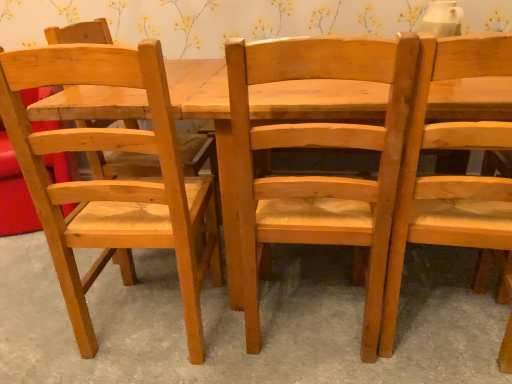
The height and width of the screenshot is (384, 512). What do you see at coordinates (113, 181) in the screenshot?
I see `natural wood chair at left, placed as the first chair when sorted from left to right` at bounding box center [113, 181].

What do you see at coordinates (452, 176) in the screenshot?
I see `natural wood chair at right, the 3th chair viewed from the left` at bounding box center [452, 176].

Where is `natural wood chair at right, the 1th chair from the right`? This screenshot has height=384, width=512. natural wood chair at right, the 1th chair from the right is located at coordinates tap(452, 176).

What do you see at coordinates (318, 146) in the screenshot? The width and height of the screenshot is (512, 384). I see `natural wood chair at center, which is the second chair from left to right` at bounding box center [318, 146].

This screenshot has height=384, width=512. What are the coordinates of `natural wood chair at left, the 3th chair viewed from the right` in the screenshot? It's located at (113, 181).

Considering the relative positions of natural wood chair at right, the 1th chair from the right, and natural wood chair at left, placed as the first chair when sorted from left to right, in the image provided, is natural wood chair at right, the 1th chair from the right, to the left or to the right of natural wood chair at left, placed as the first chair when sorted from left to right,?

Based on their positions, natural wood chair at right, the 1th chair from the right, is located to the right of natural wood chair at left, placed as the first chair when sorted from left to right.

From a real-world perspective, who is located higher, natural wood chair at right, the 3th chair viewed from the left, or natural wood chair at left, placed as the first chair when sorted from left to right?

natural wood chair at left, placed as the first chair when sorted from left to right.

Is natural wood chair at right, the 3th chair viewed from the left, aimed at natural wood chair at left, the 3th chair viewed from the right?

No, natural wood chair at right, the 3th chair viewed from the left, does not turn towards natural wood chair at left, the 3th chair viewed from the right.

Is point (411, 262) less distant than point (400, 154)?

No.

Can we say natural wood chair at center lies outside natural wood chair at center, marked as the second chair in a right-to-left arrangement?

Yes, natural wood chair at center is outside of natural wood chair at center, marked as the second chair in a right-to-left arrangement.

Relative to natural wood chair at center, marked as the second chair in a right-to-left arrangement, is natural wood chair at center in front or behind?

Clearly, natural wood chair at center is behind natural wood chair at center, marked as the second chair in a right-to-left arrangement.

Is natural wood chair at right, the 1th chair from the right, taller or shorter than natural wood chair at center, which is the second chair from left to right?

natural wood chair at right, the 1th chair from the right, is taller than natural wood chair at center, which is the second chair from left to right.

Where is `chair that is the 1st one when counting leftward from the natural wood chair at right, the 3th chair viewed from the left`? This screenshot has width=512, height=384. chair that is the 1st one when counting leftward from the natural wood chair at right, the 3th chair viewed from the left is located at coordinates (318, 146).

Which object is further away from the camera, natural wood chair at right, the 1th chair from the right, or natural wood chair at center, marked as the second chair in a right-to-left arrangement?

natural wood chair at center, marked as the second chair in a right-to-left arrangement, is more distant.

Which object is positioned more to the left, natural wood chair at right, the 1th chair from the right, or natural wood chair at center, marked as the second chair in a right-to-left arrangement?

Positioned to the left is natural wood chair at center, marked as the second chair in a right-to-left arrangement.

Is natural wood chair at center, marked as the second chair in a right-to-left arrangement, positioned far away from natural wood chair at center?

No, natural wood chair at center, marked as the second chair in a right-to-left arrangement, is not far from natural wood chair at center.

Is natural wood chair at center, marked as the second chair in a right-to-left arrangement, oriented towards natural wood chair at center?

No, natural wood chair at center, marked as the second chair in a right-to-left arrangement, is not turned towards natural wood chair at center.

Is natural wood chair at center, marked as the second chair in a right-to-left arrangement, inside or outside of natural wood chair at center?

natural wood chair at center, marked as the second chair in a right-to-left arrangement, lies outside natural wood chair at center.

Is point (236, 149) positioned behind point (490, 349)?

No.

Is natural wood chair at right, the 3th chair viewed from the left, a part of natural wood chair at left, placed as the first chair when sorted from left to right?

That's incorrect, natural wood chair at right, the 3th chair viewed from the left, is not inside natural wood chair at left, placed as the first chair when sorted from left to right.

Which of these two, natural wood chair at left, placed as the first chair when sorted from left to right, or natural wood chair at right, the 3th chair viewed from the left, is bigger?

natural wood chair at left, placed as the first chair when sorted from left to right.

Looking at this image, which object is positioned more to the left, natural wood chair at left, placed as the first chair when sorted from left to right, or natural wood chair at right, the 1th chair from the right?

Positioned to the left is natural wood chair at left, placed as the first chair when sorted from left to right.

Who is smaller, natural wood chair at left, placed as the first chair when sorted from left to right, or natural wood chair at center, marked as the second chair in a right-to-left arrangement?

natural wood chair at center, marked as the second chair in a right-to-left arrangement, is smaller.

Is natural wood chair at left, placed as the first chair when sorted from left to right, directly adjacent to natural wood chair at center, marked as the second chair in a right-to-left arrangement?

There is a gap between natural wood chair at left, placed as the first chair when sorted from left to right, and natural wood chair at center, marked as the second chair in a right-to-left arrangement.

Based on the photo, from a real-world perspective, is natural wood chair at left, the 3th chair viewed from the right, on natural wood chair at center, marked as the second chair in a right-to-left arrangement?

Yes, from a real-world perspective, natural wood chair at left, the 3th chair viewed from the right, is over natural wood chair at center, marked as the second chair in a right-to-left arrangement

Is natural wood chair at center taller than natural wood chair at left, the 3th chair viewed from the right?

Incorrect, the height of natural wood chair at center is not larger of that of natural wood chair at left, the 3th chair viewed from the right.

From the image's perspective, would you say natural wood chair at center is shown under natural wood chair at left, the 3th chair viewed from the right?

Indeed, from the image's perspective, natural wood chair at center is shown beneath natural wood chair at left, the 3th chair viewed from the right.

Who is smaller, natural wood chair at center or natural wood chair at left, placed as the first chair when sorted from left to right?

Smaller between the two is natural wood chair at center.

Is natural wood chair at center to the left or to the right of natural wood chair at left, the 3th chair viewed from the right, in the image?

In the image, natural wood chair at center appears on the right side of natural wood chair at left, the 3th chair viewed from the right.

Locate an element on the screen. The width and height of the screenshot is (512, 384). chair that is the 2nd object located in front of the natural wood chair at left, the 3th chair viewed from the right is located at coordinates (452, 176).

This screenshot has width=512, height=384. In order to click on concrete below the natural wood chair at center, marked as the second chair in a right-to-left arrangement (from a real-world perspective) in this screenshot , I will do `click(243, 322)`.

When comparing their distances from natural wood chair at center, which is the second chair from left to right, does natural wood chair at center or natural wood chair at right, the 3th chair viewed from the left, seem closer?

natural wood chair at right, the 3th chair viewed from the left, is positioned closer to the anchor natural wood chair at center, which is the second chair from left to right.

Considering their positions, is natural wood chair at right, the 1th chair from the right, positioned closer to natural wood chair at center, which is the second chair from left to right, than natural wood chair at center?

natural wood chair at right, the 1th chair from the right, is positioned closer to the anchor natural wood chair at center, which is the second chair from left to right.

Based on their spatial positions, is natural wood chair at center, which is the second chair from left to right, or natural wood chair at left, placed as the first chair when sorted from left to right, closer to natural wood chair at center?

natural wood chair at left, placed as the first chair when sorted from left to right, is positioned closer to the anchor natural wood chair at center.

Looking at the image, which one is located closer to natural wood chair at left, the 3th chair viewed from the right, natural wood chair at center, which is the second chair from left to right, or natural wood chair at right, the 1th chair from the right?

natural wood chair at center, which is the second chair from left to right, lies closer to natural wood chair at left, the 3th chair viewed from the right, than the other object.

Based on the photo, estimate the real-world distances between objects in this image. Which object is closer to natural wood chair at left, placed as the first chair when sorted from left to right, natural wood chair at right, the 1th chair from the right, or natural wood chair at center, which is the second chair from left to right?

natural wood chair at center, which is the second chair from left to right, is closer to natural wood chair at left, placed as the first chair when sorted from left to right.

Based on their spatial positions, is natural wood chair at center or natural wood chair at right, the 3th chair viewed from the left, closer to natural wood chair at left, the 3th chair viewed from the right?

The object closer to natural wood chair at left, the 3th chair viewed from the right, is natural wood chair at center.

Based on their spatial positions, is natural wood chair at left, placed as the first chair when sorted from left to right, or natural wood chair at center closer to natural wood chair at center, which is the second chair from left to right?

natural wood chair at left, placed as the first chair when sorted from left to right, lies closer to natural wood chair at center, which is the second chair from left to right, than the other object.

Considering their positions, is natural wood chair at left, placed as the first chair when sorted from left to right, positioned further to natural wood chair at right, the 3th chair viewed from the left, than natural wood chair at center?

The object further to natural wood chair at right, the 3th chair viewed from the left, is natural wood chair at left, placed as the first chair when sorted from left to right.

This screenshot has width=512, height=384. Identify the location of chair between natural wood chair at left, the 3th chair viewed from the right, and natural wood chair at right, the 1th chair from the right, in the horizontal direction. (318, 146).

I want to click on concrete between natural wood chair at left, placed as the first chair when sorted from left to right, and natural wood chair at right, the 3th chair viewed from the left, in the horizontal direction, so click(x=243, y=322).

The width and height of the screenshot is (512, 384). I want to click on concrete between natural wood chair at left, the 3th chair viewed from the right, and natural wood chair at center, marked as the second chair in a right-to-left arrangement, in the horizontal direction, so click(x=243, y=322).

Where is `chair located between natural wood chair at center and natural wood chair at right, the 1th chair from the right, in the left-right direction`? The height and width of the screenshot is (384, 512). chair located between natural wood chair at center and natural wood chair at right, the 1th chair from the right, in the left-right direction is located at coordinates (318, 146).